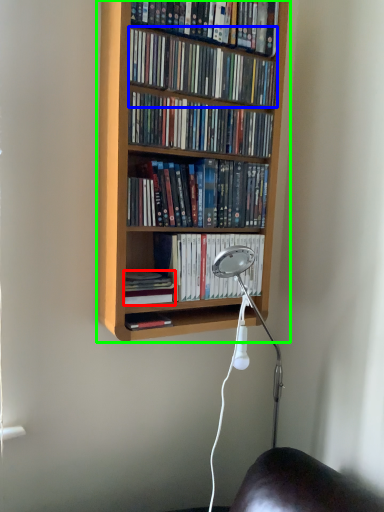
Question: Which object is positioned farthest from book (highlighted by a red box)? Select from book (highlighted by a blue box) and bookcase (highlighted by a green box).

Choices:
 (A) book
 (B) bookcase

Answer: (A)